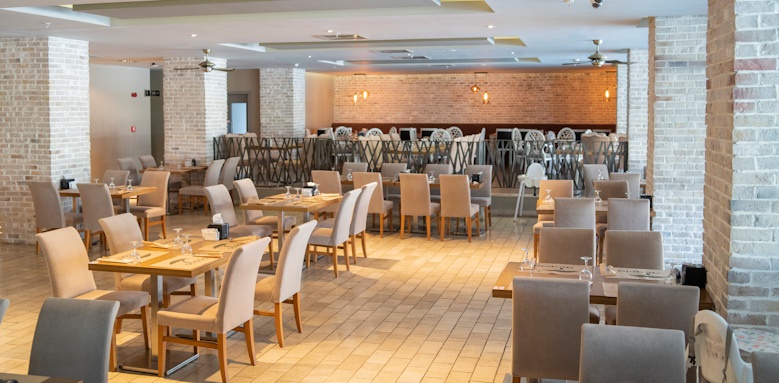
Find the location of a particular element. This screenshot has width=779, height=383. lower level table is located at coordinates (36, 379), (509, 271), (181, 260), (118, 184), (178, 163), (283, 199), (393, 181), (545, 206).